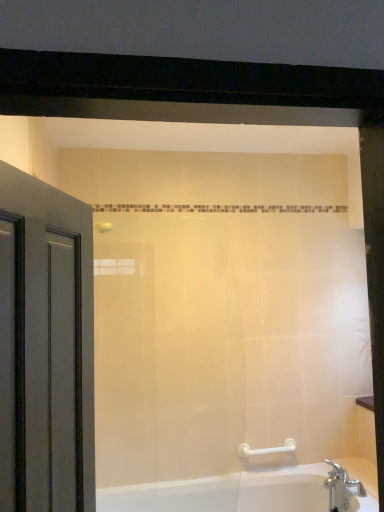
Question: Relative to chrome metallic faucet at lower right, is white plastic grab bar at lower right in front or behind?

Choices:
 (A) behind
 (B) front

Answer: (A)

Question: Is white plastic grab bar at lower right wider or thinner than chrome metallic faucet at lower right?

Choices:
 (A) thin
 (B) wide

Answer: (A)

Question: Estimate the real-world distances between objects in this image. Which object is closer to the white glossy bathtub at lower right?

Choices:
 (A) matte gray door at left
 (B) white plastic grab bar at lower right
 (C) chrome metallic faucet at lower right

Answer: (B)

Question: Estimate the real-world distances between objects in this image. Which object is farther from the white plastic grab bar at lower right?

Choices:
 (A) chrome metallic faucet at lower right
 (B) white glossy bathtub at lower right
 (C) matte gray door at left

Answer: (C)